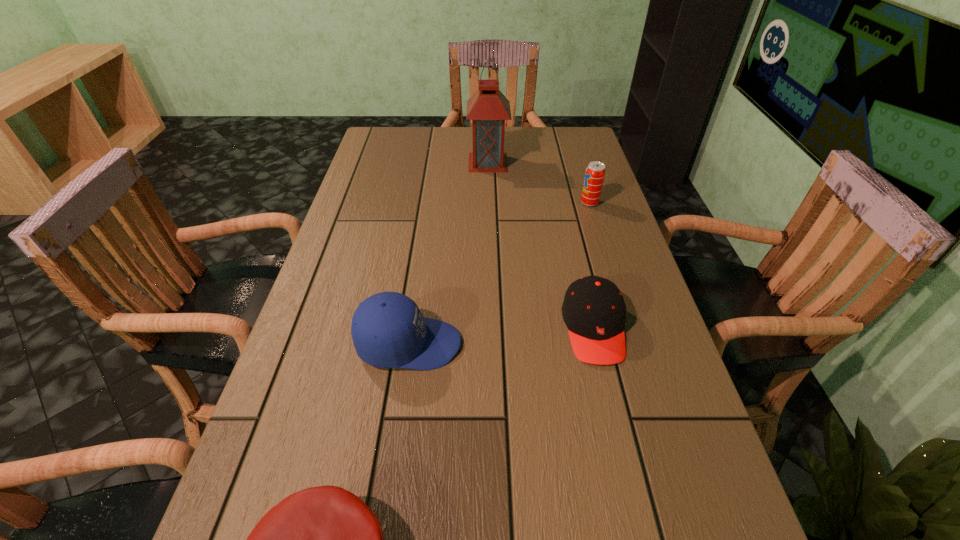
Locate an element on the screen. The image size is (960, 540). the farthest object is located at coordinates (488, 108).

Where is `lantern`? This screenshot has height=540, width=960. lantern is located at coordinates click(488, 108).

Where is `soda can`? soda can is located at coordinates (595, 172).

This screenshot has height=540, width=960. What are the coordinates of `the tallest cap` in the screenshot? It's located at (388, 330).

Find the location of a particular element. This screenshot has height=540, width=960. the rightmost cap is located at coordinates (594, 311).

Image resolution: width=960 pixels, height=540 pixels. I want to click on free space located 0.110m on the front of the farthest object, so click(x=489, y=192).

Locate an element on the screen. This screenshot has width=960, height=540. free space located on the back of the soda can is located at coordinates (582, 179).

Locate an element on the screen. vacant area situated 0.340m on the front-facing side of the tallest cap is located at coordinates (625, 344).

Find the location of a particular element. vacant space located on the front-facing side of the rightmost cap is located at coordinates (611, 399).

The height and width of the screenshot is (540, 960). Find the location of `object that is positioned at the far edge`. object that is positioned at the far edge is located at coordinates (488, 108).